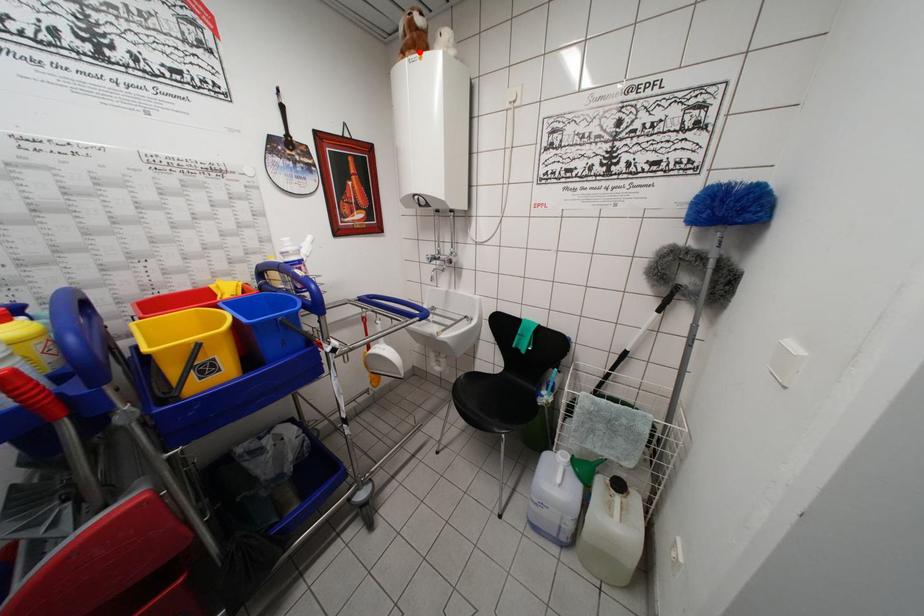
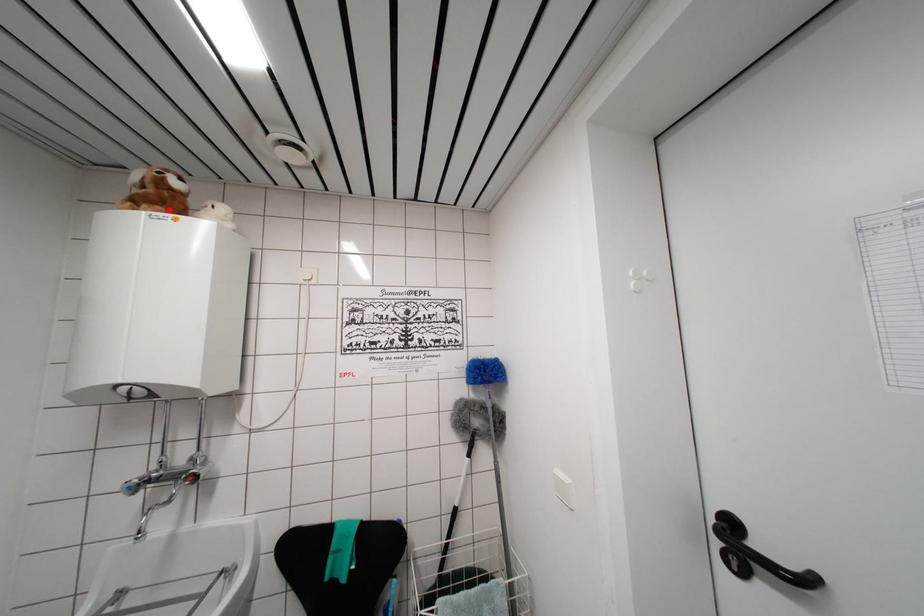
I am providing you with two images of the same scene from different viewpoints. A red point is marked on the first image and another point is marked on the second image. Are the points marked in image1 and image2 representing the same 3D position?

Yes